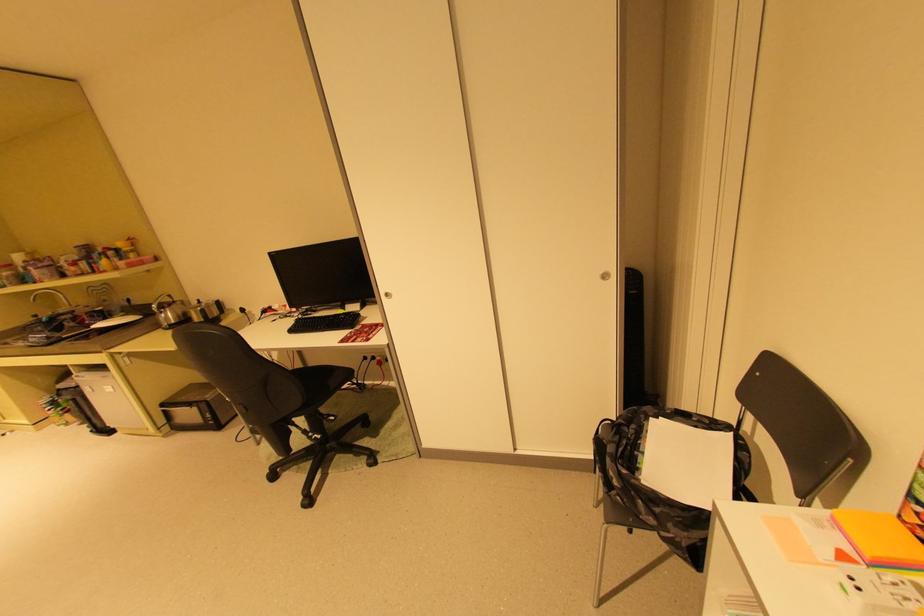
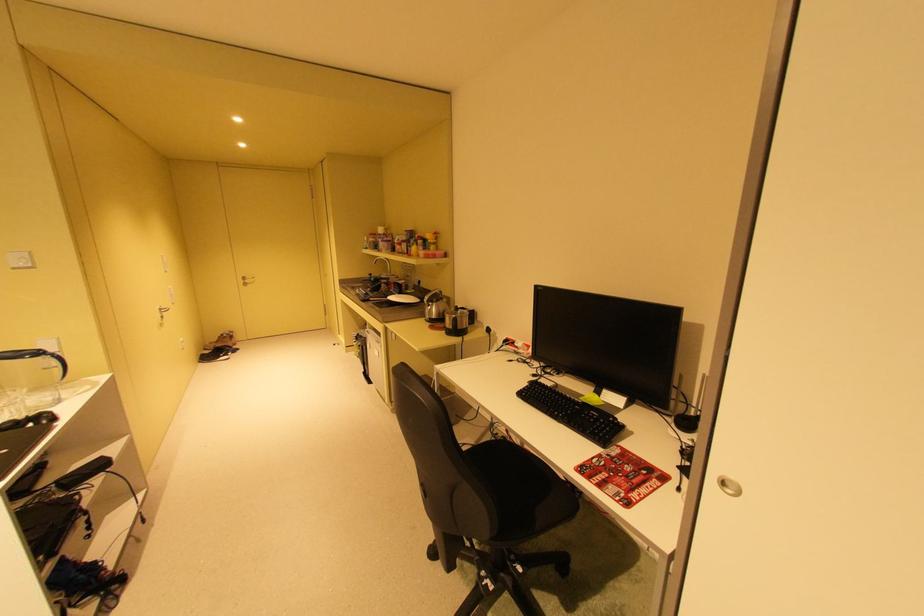
The point at (353, 318) is marked in the first image. Where is the corresponding point in the second image?

(604, 419)